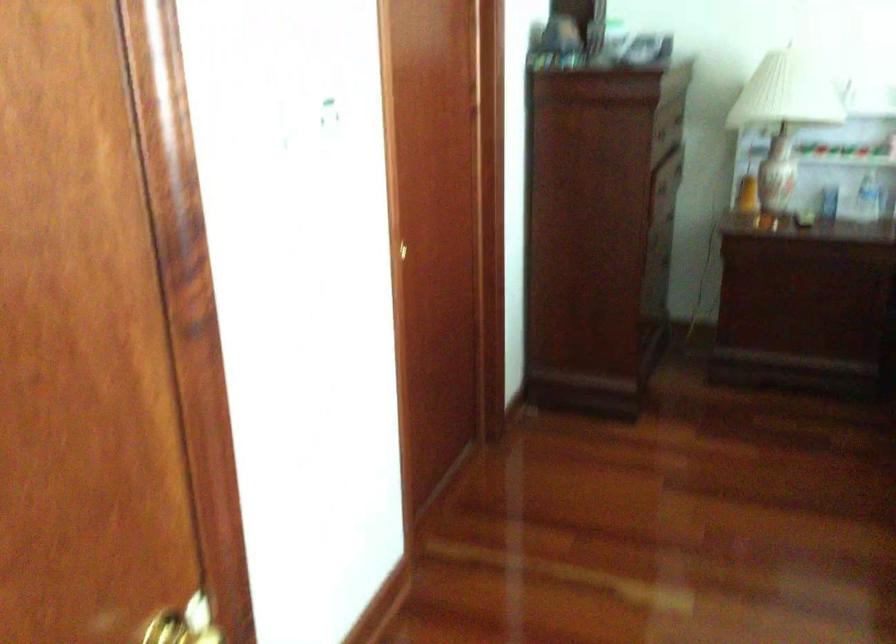
I want to click on gold door knob, so click(185, 623).